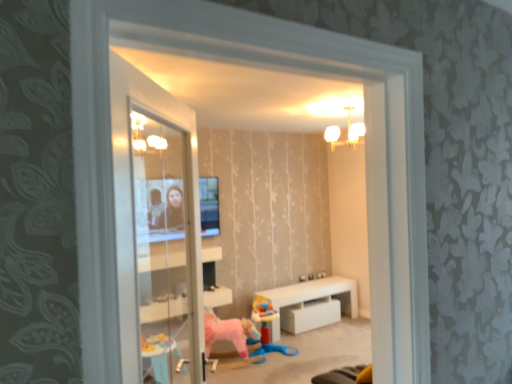
Question: From a real-world perspective, relative to plastic blue toy at center, is transparent glass window at center vertically above or below?

Choices:
 (A) below
 (B) above

Answer: (B)

Question: Based on their positions, is transparent glass window at center located to the left or right of plastic blue toy at center?

Choices:
 (A) left
 (B) right

Answer: (B)

Question: Which of these objects is positioned closest to the white glossy table at center?

Choices:
 (A) white frosted glass chandelier at upper center
 (B) pink fabric horse at center
 (C) plastic blue toy at center
 (D) transparent glass window at center

Answer: (C)

Question: Estimate the real-world distances between objects in this image. Which object is closer to the white glossy table at center?

Choices:
 (A) plastic blue toy at center
 (B) white frosted glass chandelier at upper center
 (C) transparent glass window at center
 (D) pink fabric horse at center

Answer: (A)